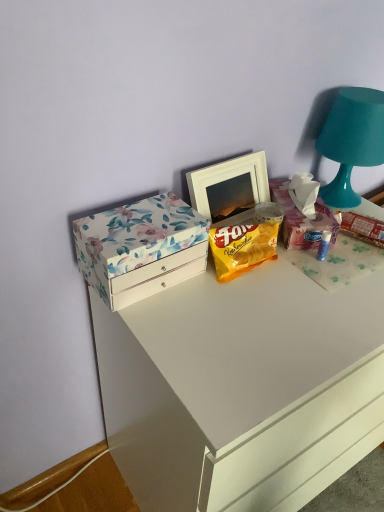
Locate an element on the screen. The height and width of the screenshot is (512, 384). floral cardboard box at upper right is located at coordinates (301, 219).

Image resolution: width=384 pixels, height=512 pixels. I want to click on teal matte table lamp at upper right, so (x=351, y=141).

What are the coordinates of `white matte picture frame at center` in the screenshot? It's located at (229, 187).

Considering the relative sizes of floral cardboard box at upper right and white matte picture frame at center in the image provided, is floral cardboard box at upper right wider than white matte picture frame at center?

Correct, the width of floral cardboard box at upper right exceeds that of white matte picture frame at center.

Between floral cardboard box at upper right and white matte picture frame at center, which one appears on the right side from the viewer's perspective?

From the viewer's perspective, floral cardboard box at upper right appears more on the right side.

From the image's perspective, is floral cardboard box at upper right beneath white matte picture frame at center?

Yes, from the image's perspective, floral cardboard box at upper right is below white matte picture frame at center.

Is floral cardboard box at upper right inside or outside of white matte picture frame at center?

floral cardboard box at upper right is not inside white matte picture frame at center, it's outside.

From a real-world perspective, is white matte picture frame at center positioned over teal matte table lamp at upper right based on gravity?

No.

Considering their positions, is white matte picture frame at center located in front of or behind teal matte table lamp at upper right?

white matte picture frame at center is positioned closer to the viewer than teal matte table lamp at upper right.

Considering the sizes of objects white matte picture frame at center and teal matte table lamp at upper right in the image provided, who is smaller, white matte picture frame at center or teal matte table lamp at upper right?

Smaller between the two is white matte picture frame at center.

Which is closer, (221, 174) or (375, 142)?

Point (221, 174) is closer to the camera than point (375, 142).

Can you confirm if teal matte table lamp at upper right is positioned to the right of floral cardboard box at upper right?

Indeed, teal matte table lamp at upper right is positioned on the right side of floral cardboard box at upper right.

Between teal matte table lamp at upper right and floral cardboard box at upper right, which one has more height?

teal matte table lamp at upper right.

Is teal matte table lamp at upper right far away from floral cardboard box at upper right?

No, teal matte table lamp at upper right is not far away from floral cardboard box at upper right.

From the image's perspective, is teal matte table lamp at upper right over floral cardboard box at upper right?

Yes, from the image's perspective, teal matte table lamp at upper right is above floral cardboard box at upper right.

From the image's perspective, is teal matte table lamp at upper right beneath white glossy chest of drawers at upper center?

Incorrect, from the image's perspective, teal matte table lamp at upper right is higher than white glossy chest of drawers at upper center.

From a real-world perspective, is teal matte table lamp at upper right located beneath white glossy chest of drawers at upper center?

No, from a real-world perspective, teal matte table lamp at upper right is not under white glossy chest of drawers at upper center.

Considering the positions of points (343, 133) and (278, 492), is point (343, 133) closer to camera compared to point (278, 492)?

No, (343, 133) is further to viewer.

Which is behind, white glossy chest of drawers at upper center or floral paper box at left?

floral paper box at left is further away from the camera.

Can you confirm if white glossy chest of drawers at upper center is positioned to the right of floral paper box at left?

Yes.

Between white glossy chest of drawers at upper center and floral paper box at left, which one has larger width?

With larger width is white glossy chest of drawers at upper center.

Is white matte picture frame at center facing away from floral cardboard box at upper right?

No, white matte picture frame at center is not facing away from floral cardboard box at upper right.

Does point (245, 207) appear closer or farther from the camera than point (311, 221)?

Point (245, 207).

Which is more to the left, white matte picture frame at center or floral cardboard box at upper right?

white matte picture frame at center is more to the left.

Would you consider white matte picture frame at center to be distant from floral cardboard box at upper right?

They are positioned close to each other.

Based on the photo, is teal matte table lamp at upper right positioned with its back to white matte picture frame at center?

That's not correct — teal matte table lamp at upper right is not looking away from white matte picture frame at center.

Is teal matte table lamp at upper right bigger or smaller than white matte picture frame at center?

Clearly, teal matte table lamp at upper right is larger in size than white matte picture frame at center.

Locate an element on the screen. The image size is (384, 512). picture frame on the left of teal matte table lamp at upper right is located at coordinates (229, 187).

Find the location of a particular element. This screenshot has height=512, width=384. picture frame on the left of floral cardboard box at upper right is located at coordinates (229, 187).

The height and width of the screenshot is (512, 384). Find the location of `table lamp above the white matte picture frame at center (from a real-world perspective)`. table lamp above the white matte picture frame at center (from a real-world perspective) is located at coordinates (351, 141).

From the picture: Looking at the image, which one is located further to floral cardboard box at upper right, white matte picture frame at center or floral paper box at left?

floral paper box at left is further to floral cardboard box at upper right.

Based on their spatial positions, is white glossy chest of drawers at upper center or white matte picture frame at center closer to floral cardboard box at upper right?

Among the two, white matte picture frame at center is located nearer to floral cardboard box at upper right.

Based on their spatial positions, is floral cardboard box at upper right or white glossy chest of drawers at upper center closer to white matte picture frame at center?

floral cardboard box at upper right lies closer to white matte picture frame at center than the other object.

Looking at the image, which one is located further to floral cardboard box at upper right, floral paper box at left or white matte picture frame at center?

floral paper box at left is positioned further to the anchor floral cardboard box at upper right.

From the image, which object appears to be nearer to floral paper box at left, floral cardboard box at upper right or white glossy chest of drawers at upper center?

white glossy chest of drawers at upper center is positioned closer to the anchor floral paper box at left.

Which object lies nearer to the anchor point teal matte table lamp at upper right, white glossy chest of drawers at upper center or floral paper box at left?

floral paper box at left lies closer to teal matte table lamp at upper right than the other object.

From the picture: Looking at the image, which one is located closer to floral cardboard box at upper right, white matte picture frame at center or white glossy chest of drawers at upper center?

The object closer to floral cardboard box at upper right is white matte picture frame at center.

Based on the photo, when comparing their distances from teal matte table lamp at upper right, does white glossy chest of drawers at upper center or floral cardboard box at upper right seem closer?

floral cardboard box at upper right.

Identify the location of picture frame between teal matte table lamp at upper right and white glossy chest of drawers at upper center from top to bottom. The image size is (384, 512). (229, 187).

Locate an element on the screen. Image resolution: width=384 pixels, height=512 pixels. storage box between white matte picture frame at center and white glossy chest of drawers at upper center in the up-down direction is located at coordinates (301, 219).

Image resolution: width=384 pixels, height=512 pixels. What are the coordinates of `picture frame between floral paper box at left and teal matte table lamp at upper right from left to right` in the screenshot? It's located at (229, 187).

Find the location of `picture frame between floral paper box at left and floral cardboard box at upper right from left to right`. picture frame between floral paper box at left and floral cardboard box at upper right from left to right is located at coordinates (229, 187).